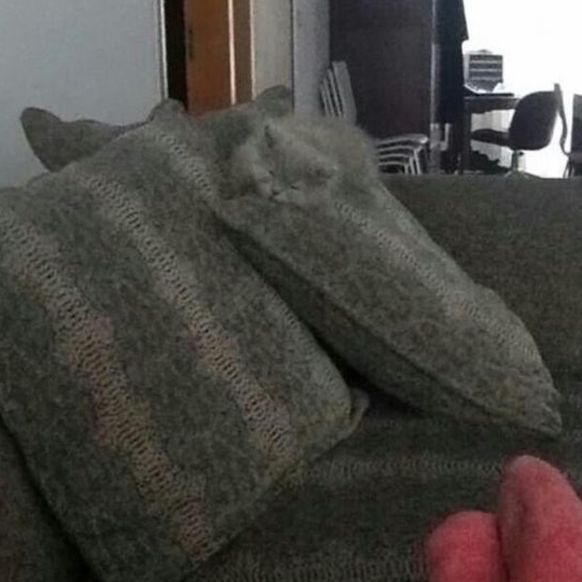
Where is `blanket`? blanket is located at coordinates (526, 247), (423, 489).